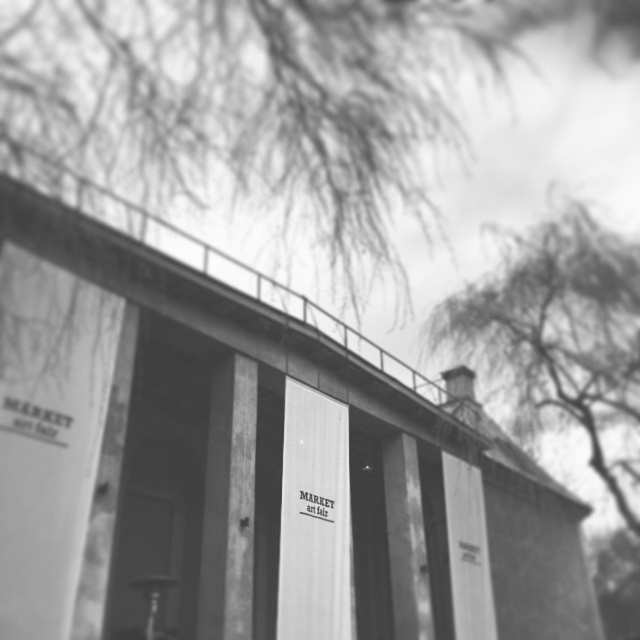
Does smooth concrete bridge at center appear over thin branches at upper right?

No.

Who is shorter, smooth concrete bridge at center or thin branches at upper right?

smooth concrete bridge at center is shorter.

Does point (244, 326) come farther from viewer compared to point (493, 381)?

No, (244, 326) is closer to viewer.

Locate an element on the screen. smooth concrete bridge at center is located at coordinates (243, 465).